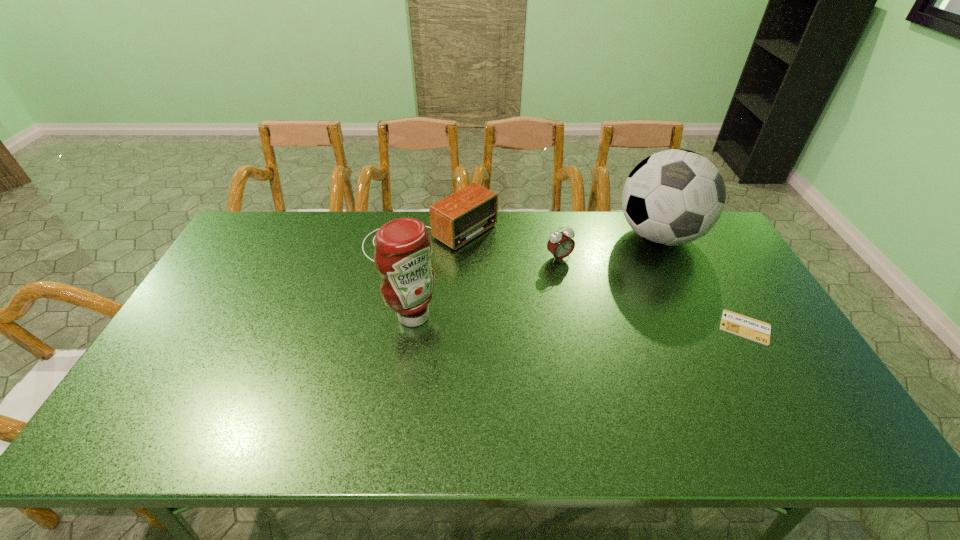
I want to click on vacant space on the desktop that is between the condiment and the shortest object and is positioned on the front-facing side of the radio receiver, so click(563, 321).

Locate an element on the screen. The height and width of the screenshot is (540, 960). free space on the desktop that is between the condiment and the identity card and is positioned on the main logo of the soccer ball is located at coordinates (614, 323).

Locate an element on the screen. This screenshot has height=540, width=960. vacant space on the desktop that is between the condiment and the identity card and is positioned on the clock face of the alarm clock is located at coordinates (615, 323).